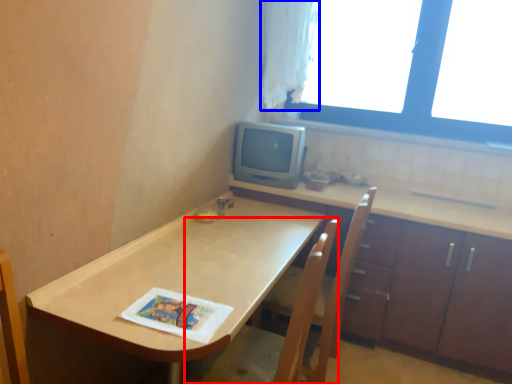
Question: Which object is closer to the camera taking this photo, swivel chair (highlighted by a red box) or curtain (highlighted by a blue box)?

Choices:
 (A) swivel chair
 (B) curtain

Answer: (A)